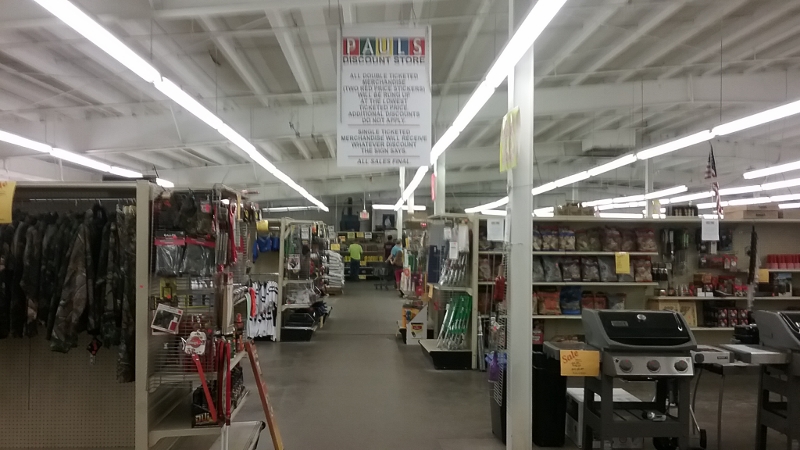
Locate an element on the screen. This screenshot has height=450, width=800. support beam is located at coordinates (516, 305).